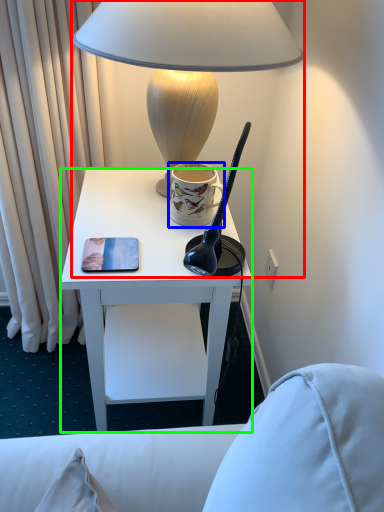
Question: Which object is the farthest from lamp (highlighted by a red box)? Choose among these: coffee cup (highlighted by a blue box) or desk (highlighted by a green box).

Choices:
 (A) coffee cup
 (B) desk

Answer: (B)